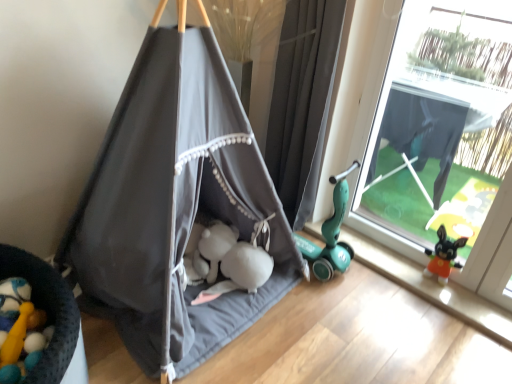
Question: Can you confirm if gray fabric curtain at right is smaller than dark gray fabric tent at center?

Choices:
 (A) no
 (B) yes

Answer: (B)

Question: Is gray fabric curtain at right looking in the opposite direction of dark gray fabric tent at center?

Choices:
 (A) yes
 (B) no

Answer: (A)

Question: Is gray fabric curtain at right at the right side of dark gray fabric tent at center?

Choices:
 (A) no
 (B) yes

Answer: (B)

Question: From a real-world perspective, is gray fabric curtain at right on top of dark gray fabric tent at center?

Choices:
 (A) no
 (B) yes

Answer: (A)

Question: From a real-world perspective, is gray fabric curtain at right physically below dark gray fabric tent at center?

Choices:
 (A) yes
 (B) no

Answer: (A)

Question: Is dark gray fabric tent at center to the left or to the right of gray fabric curtain at right in the image?

Choices:
 (A) left
 (B) right

Answer: (A)

Question: Based on their sizes in the image, would you say dark gray fabric tent at center is bigger or smaller than gray fabric curtain at right?

Choices:
 (A) big
 (B) small

Answer: (A)

Question: Considering the positions of dark gray fabric tent at center and gray fabric curtain at right in the image, is dark gray fabric tent at center wider or thinner than gray fabric curtain at right?

Choices:
 (A) wide
 (B) thin

Answer: (A)

Question: Considering the positions of dark gray fabric tent at center and gray fabric curtain at right in the image, is dark gray fabric tent at center taller or shorter than gray fabric curtain at right?

Choices:
 (A) short
 (B) tall

Answer: (B)

Question: In terms of size, does transparent plastic window at right appear bigger or smaller than dark gray fabric tent at center?

Choices:
 (A) small
 (B) big

Answer: (A)

Question: Is transparent plastic window at right in front of or behind dark gray fabric tent at center in the image?

Choices:
 (A) front
 (B) behind

Answer: (B)

Question: Visually, is transparent plastic window at right positioned to the left or to the right of dark gray fabric tent at center?

Choices:
 (A) right
 (B) left

Answer: (A)

Question: Considering the positions of point (489, 97) and point (240, 316), is point (489, 97) closer or farther from the camera than point (240, 316)?

Choices:
 (A) closer
 (B) farther

Answer: (B)

Question: Do you think gray fabric curtain at right is within dark gray fabric tent at center, or outside of it?

Choices:
 (A) outside
 (B) inside

Answer: (A)

Question: Is gray fabric curtain at right bigger or smaller than dark gray fabric tent at center?

Choices:
 (A) big
 (B) small

Answer: (B)